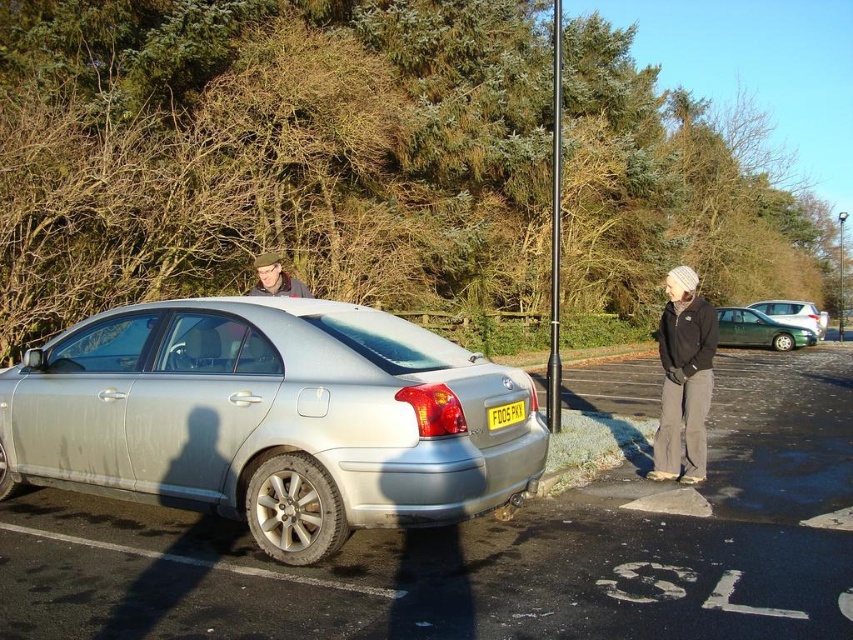
Question: Which point is closer to the camera taking this photo?

Choices:
 (A) (753, 305)
 (B) (805, 422)
 (C) (233, 401)

Answer: (C)

Question: Does green matte car at right have a larger size compared to yellow matte license plate at center?

Choices:
 (A) no
 (B) yes

Answer: (B)

Question: Which object appears farthest from the camera in this image?

Choices:
 (A) black knit hat at center
 (B) silver metallic sedan at center

Answer: (A)

Question: Estimate the real-world distances between objects in this image. Which object is farther from the silver metallic car at center?

Choices:
 (A) yellow matte license plate at center
 (B) green matte car at right
 (C) black knit hat at center

Answer: (B)

Question: Does silver metallic sedan at center appear over black knit hat at center?

Choices:
 (A) no
 (B) yes

Answer: (A)

Question: Can you confirm if black knit hat at center is bigger than green metallic hatchback at right?

Choices:
 (A) yes
 (B) no

Answer: (B)